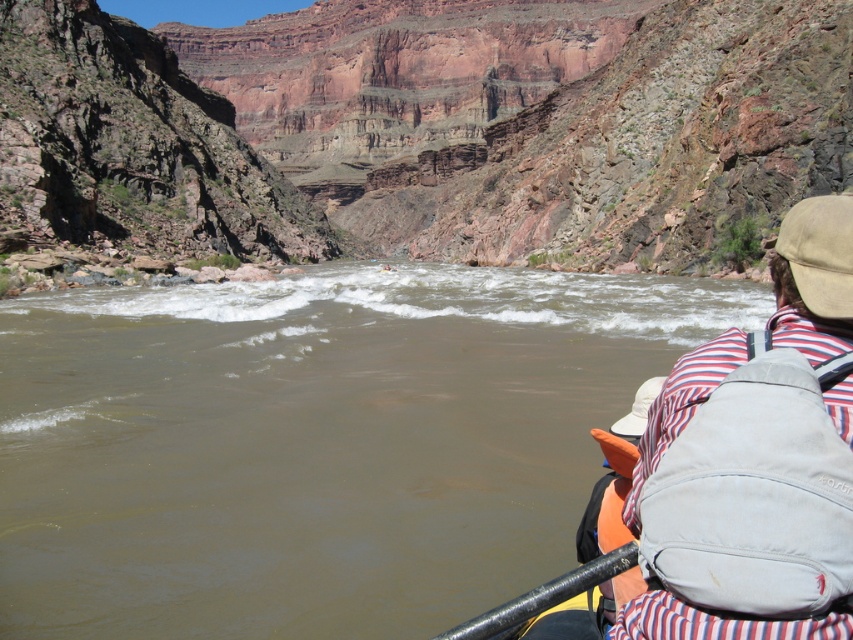
In the scene shown: Who is shorter, rustic rock canyon at center or orange fabric life jacket at lower right?

Standing shorter between the two is orange fabric life jacket at lower right.

Locate an element on the screen. The image size is (853, 640). rustic rock canyon at center is located at coordinates (430, 125).

Does point (74, 36) come closer to viewer compared to point (614, 444)?

No, (74, 36) is further to viewer.

I want to click on rustic rock canyon at center, so (x=430, y=125).

Between brown muddy water at center and rustic rock canyon at center, which one is positioned lower?

brown muddy water at center is lower down.

Can you confirm if brown muddy water at center is positioned above rustic rock canyon at center?

Actually, brown muddy water at center is below rustic rock canyon at center.

Who is more distant from viewer, (164, 337) or (42, 74)?

The point (42, 74) is more distant.

This screenshot has height=640, width=853. What are the coordinates of `brown muddy water at center` in the screenshot? It's located at (316, 442).

Is point (352, 532) more distant than point (735, 404)?

Yes, it is behind point (735, 404).

Who is more distant from viewer, (469,422) or (737,451)?

Positioned behind is point (469,422).

Does point (25, 556) lie behind point (686, 451)?

Yes, it is.

Where is `brown muddy water at center`? brown muddy water at center is located at coordinates (316, 442).